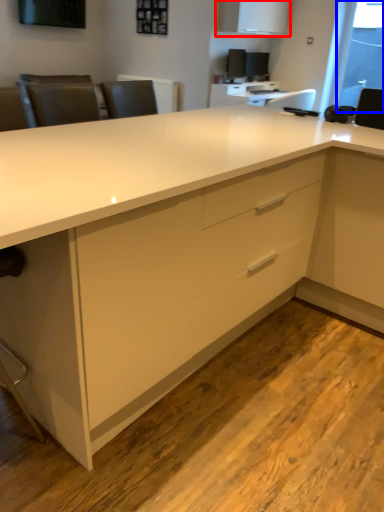
Question: Which object appears closest to the camera in this image, cabinetry (highlighted by a red box) or window screen (highlighted by a blue box)?

Choices:
 (A) cabinetry
 (B) window screen

Answer: (A)